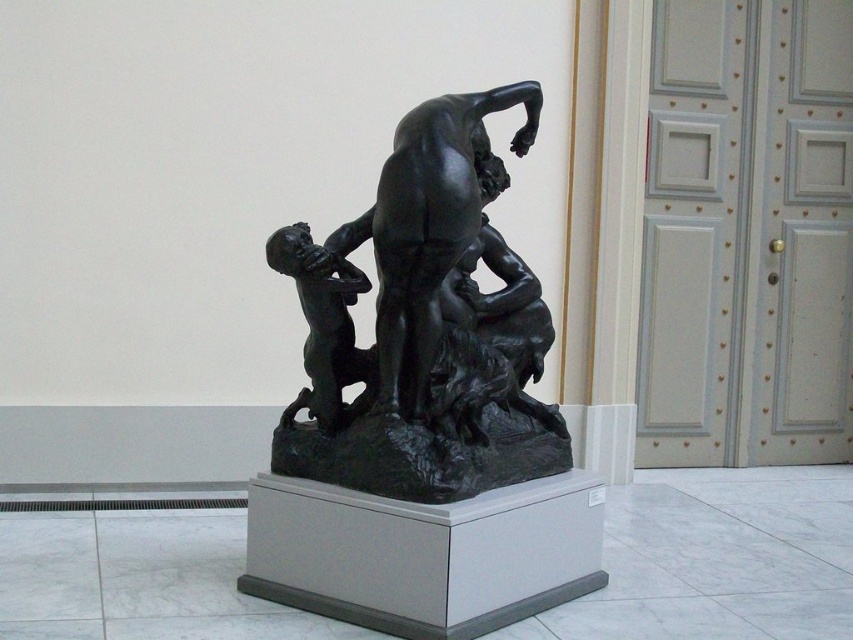
Question: Does black polished bronze sculpture at center appear over matte black figure at center-left?

Choices:
 (A) no
 (B) yes

Answer: (B)

Question: Which of the following is the closest to the observer?

Choices:
 (A) pos(328,275)
 (B) pos(502,189)

Answer: (A)

Question: Is black polished bronze sculpture at center to the left of matte black figure at center-left from the viewer's perspective?

Choices:
 (A) no
 (B) yes

Answer: (A)

Question: Is black polished bronze sculpture at center further to the viewer compared to matte black figure at center-left?

Choices:
 (A) no
 (B) yes

Answer: (A)